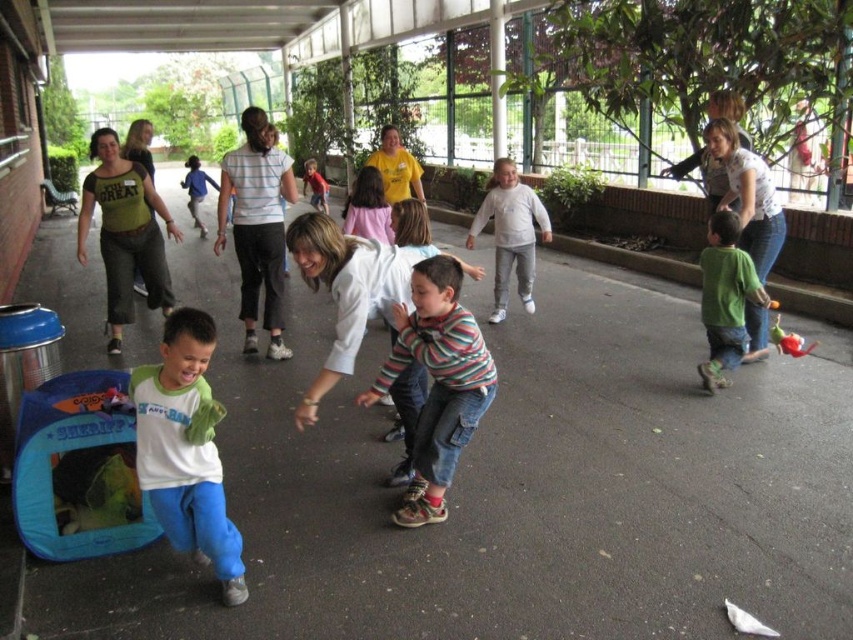
Question: In this image, where is white matte shirt at center located relative to green matte shirt at right?

Choices:
 (A) above
 (B) below

Answer: (B)

Question: Which point appears closest to the camera in this image?

Choices:
 (A) (724, 273)
 (B) (180, 394)

Answer: (B)

Question: Does white matte shirt at center have a lesser width compared to green matte shirt at right?

Choices:
 (A) yes
 (B) no

Answer: (B)

Question: Is striped cotton shirt at center bigger than green matte shirt at right?

Choices:
 (A) no
 (B) yes

Answer: (B)

Question: Which point is closer to the camera?

Choices:
 (A) (759, 284)
 (B) (450, 419)

Answer: (B)

Question: Which is farther from the green matte shirt at right?

Choices:
 (A) white matte shirt at center
 (B) striped cotton shirt at center

Answer: (A)